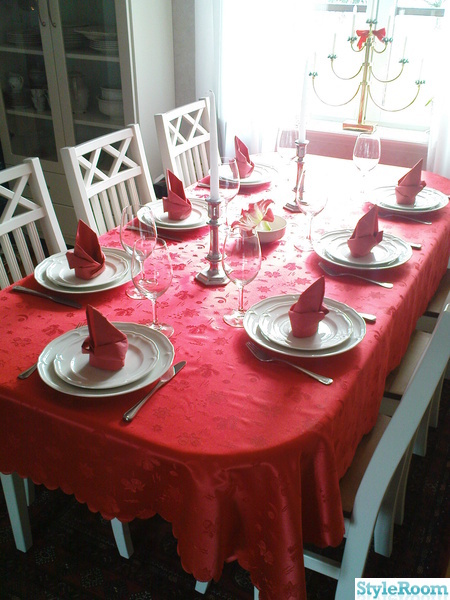
This screenshot has height=600, width=450. What are the coordinates of `4 forks` in the screenshot? It's located at (26, 379), (266, 362), (372, 280), (428, 224).